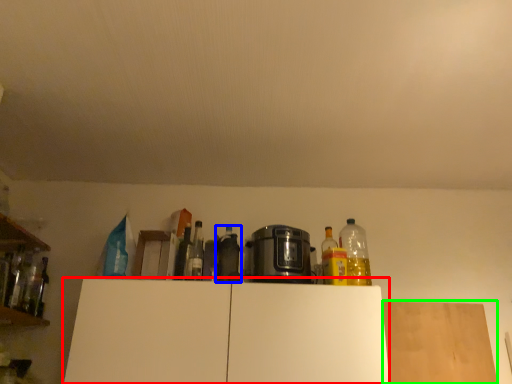
Question: Based on their relative distances, which object is farther from cabinetry (highlighted by a red box)? Choose from bottle (highlighted by a blue box) and plywood (highlighted by a green box).

Choices:
 (A) bottle
 (B) plywood

Answer: (B)